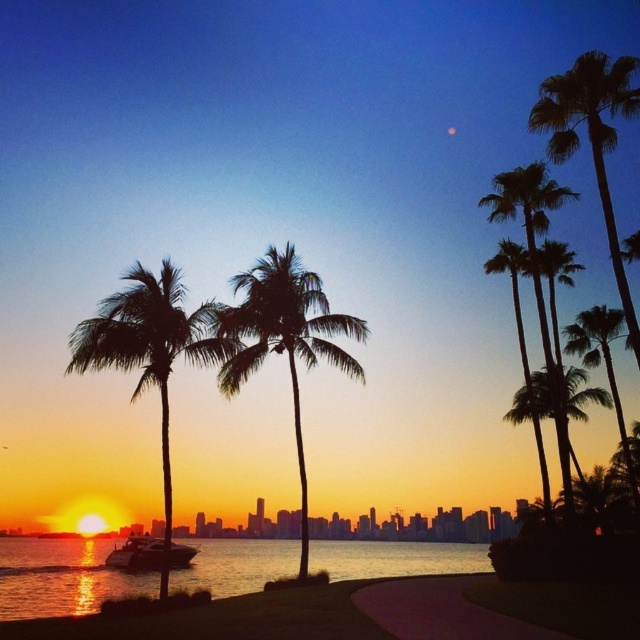
Does silhouette palm tree at center come in front of silky black palm trees at upper right?

Yes, silhouette palm tree at center is in front of silky black palm trees at upper right.

Who is higher up, silhouette palm tree at center or silky black palm trees at upper right?

Positioned higher is silky black palm trees at upper right.

Who is more forward, (298, 396) or (509, 189)?

Positioned in front is point (509, 189).

Find the location of `silhouette palm tree at center`. silhouette palm tree at center is located at coordinates (284, 339).

Consider the image. Can you confirm if silky green palm tree at right is positioned below silky black palm tree at right?

Result: Correct, silky green palm tree at right is located below silky black palm tree at right.

Can you confirm if silky green palm tree at right is taller than silky black palm tree at right?

No, silky green palm tree at right is not taller than silky black palm tree at right.

Who is more forward, (x=541, y=406) or (x=552, y=253)?

Positioned in front is point (x=552, y=253).

Image resolution: width=640 pixels, height=640 pixels. What are the coordinates of `silky green palm tree at right` in the screenshot? It's located at (531, 401).

Measure the distance between green leafy palm tree at left and camera.

green leafy palm tree at left and camera are 16.83 meters apart from each other.

Between green leafy palm tree at left and silhouette palm tree at center, which one has less height?

green leafy palm tree at left

Image resolution: width=640 pixels, height=640 pixels. I want to click on green leafy palm tree at left, so click(150, 349).